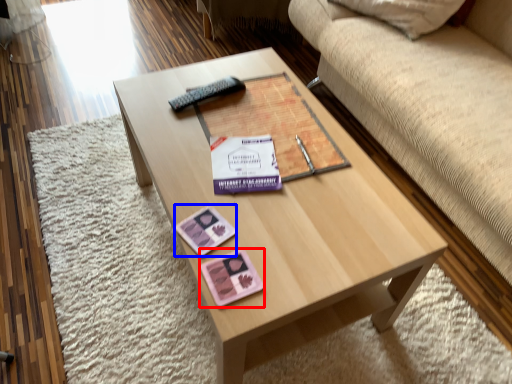
Question: Which of the following is the farthest to the observer, currency (highlighted by a red box) or currency (highlighted by a blue box)?

Choices:
 (A) currency
 (B) currency

Answer: (B)